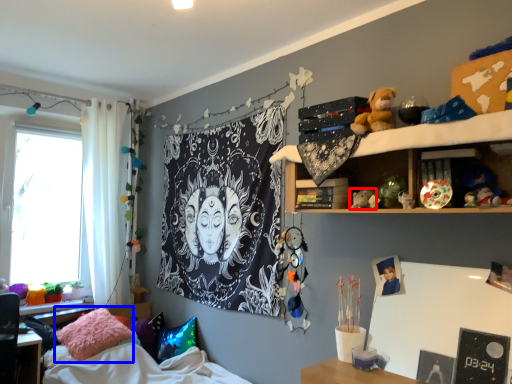
Question: Which point is closer to the camera, toy (highlighted by a red box) or pillow (highlighted by a blue box)?

Choices:
 (A) toy
 (B) pillow

Answer: (A)